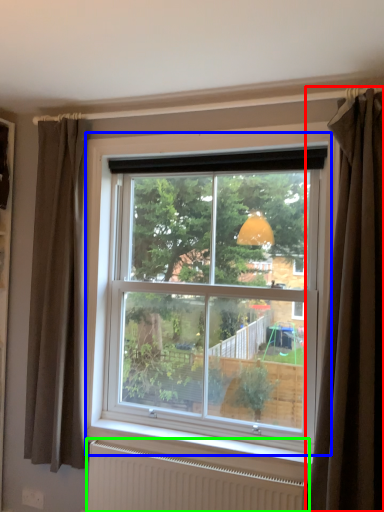
Question: Estimate the real-world distances between objects in this image. Which object is farther from curtain (highlighted by a red box), window (highlighted by a blue box) or radiator (highlighted by a green box)?

Choices:
 (A) window
 (B) radiator

Answer: (B)